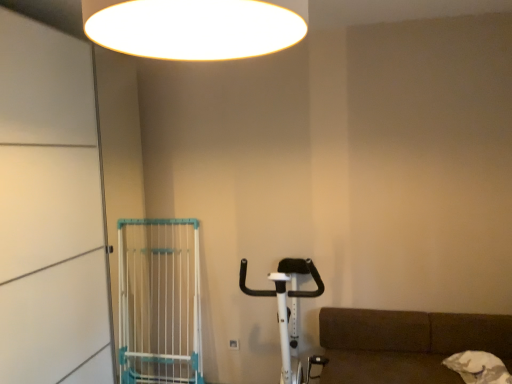
Question: Can you confirm if white glossy ceiling light at upper center is taller than white plastic screen door at left?

Choices:
 (A) no
 (B) yes

Answer: (A)

Question: Can you confirm if white glossy ceiling light at upper center is positioned to the right of white plastic screen door at left?

Choices:
 (A) no
 (B) yes

Answer: (B)

Question: From a real-world perspective, is white glossy ceiling light at upper center located higher than white plastic screen door at left?

Choices:
 (A) yes
 (B) no

Answer: (A)

Question: From a real-world perspective, is white glossy ceiling light at upper center positioned under white plastic screen door at left based on gravity?

Choices:
 (A) no
 (B) yes

Answer: (A)

Question: Is white glossy ceiling light at upper center far from white plastic screen door at left?

Choices:
 (A) yes
 (B) no

Answer: (A)

Question: Considering the positions of white plastic screen door at left and white fabric bag at lower right in the image, is white plastic screen door at left bigger or smaller than white fabric bag at lower right?

Choices:
 (A) big
 (B) small

Answer: (A)

Question: Which is correct: white plastic screen door at left is inside white fabric bag at lower right, or outside of it?

Choices:
 (A) outside
 (B) inside

Answer: (A)

Question: Looking at their shapes, would you say white plastic screen door at left is wider or thinner than white fabric bag at lower right?

Choices:
 (A) wide
 (B) thin

Answer: (A)

Question: From their relative heights in the image, would you say white plastic screen door at left is taller or shorter than white fabric bag at lower right?

Choices:
 (A) tall
 (B) short

Answer: (A)

Question: Is white glossy ceiling light at upper center situated inside white fabric bag at lower right or outside?

Choices:
 (A) outside
 (B) inside

Answer: (A)

Question: In terms of width, does white glossy ceiling light at upper center look wider or thinner when compared to white fabric bag at lower right?

Choices:
 (A) wide
 (B) thin

Answer: (A)

Question: Considering the relative positions of white glossy ceiling light at upper center and white fabric bag at lower right in the image provided, is white glossy ceiling light at upper center to the left or to the right of white fabric bag at lower right?

Choices:
 (A) right
 (B) left

Answer: (B)

Question: In the image, is white glossy ceiling light at upper center positioned in front of or behind white fabric bag at lower right?

Choices:
 (A) front
 (B) behind

Answer: (A)

Question: From a real-world perspective, relative to white plastic gate at left, is white fabric bag at lower right vertically above or below?

Choices:
 (A) above
 (B) below

Answer: (B)

Question: Considering the positions of point (492, 354) and point (138, 281), is point (492, 354) closer or farther from the camera than point (138, 281)?

Choices:
 (A) farther
 (B) closer

Answer: (B)